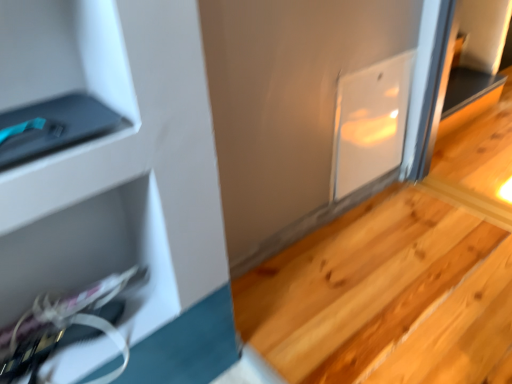
Describe the element at coordinates (372, 290) in the screenshot. I see `natural wood stairs at lower right` at that location.

Where is `natural wood stairs at lower right`? The height and width of the screenshot is (384, 512). natural wood stairs at lower right is located at coordinates (372, 290).

What do you see at coordinates (95, 256) in the screenshot? I see `white glossy scissors at lower left` at bounding box center [95, 256].

In order to face white glossy scissors at lower left, should I rotate leftwards or rightwards?

You should look left and rotate roughly 21.770 degrees.

You are a GUI agent. You are given a task and a screenshot of the screen. Output one action in this format:
    pyautogui.click(x=<x>, y=<y>)
    Task: Click on the white glossy scissors at lower left
    This screenshot has height=384, width=512.
    Given the screenshot: What is the action you would take?
    pyautogui.click(x=95, y=256)

I want to click on natural wood stairs at lower right, so click(x=372, y=290).

Can you confirm if natural wood stairs at lower right is positioned to the right of white glossy scissors at lower left?

Indeed, natural wood stairs at lower right is positioned on the right side of white glossy scissors at lower left.

Is natural wood stairs at lower right positioned before white glossy scissors at lower left?

No.

Does point (481, 305) lie behind point (19, 289)?

That is True.

From the image's perspective, is natural wood stairs at lower right above or below white glossy scissors at lower left?

From the image's perspective, natural wood stairs at lower right appears below white glossy scissors at lower left.

From a real-world perspective, which object stands above the other?

white glossy scissors at lower left, from a real-world perspective.

Looking at their sizes, would you say natural wood stairs at lower right is wider or thinner than white glossy scissors at lower left?

Clearly, natural wood stairs at lower right has more width compared to white glossy scissors at lower left.

Considering the relative sizes of natural wood stairs at lower right and white glossy scissors at lower left in the image provided, is natural wood stairs at lower right shorter than white glossy scissors at lower left?

No, natural wood stairs at lower right is not shorter than white glossy scissors at lower left.

In the scene shown: Does natural wood stairs at lower right have a larger size compared to white glossy scissors at lower left?

Yes, natural wood stairs at lower right is bigger than white glossy scissors at lower left.

Is natural wood stairs at lower right spatially inside white glossy scissors at lower left, or outside of it?

natural wood stairs at lower right is spatially situated outside white glossy scissors at lower left.

Is natural wood stairs at lower right positioned far away from white glossy scissors at lower left?

No, natural wood stairs at lower right is in close proximity to white glossy scissors at lower left.

Is natural wood stairs at lower right aimed at white glossy scissors at lower left?

No, natural wood stairs at lower right is not oriented towards white glossy scissors at lower left.

The image size is (512, 384). Identify the location of stair below the white glossy scissors at lower left (from the image's perspective). (372, 290).

Which is more to the right, white glossy scissors at lower left or natural wood stairs at lower right?

natural wood stairs at lower right.

Is the depth of white glossy scissors at lower left less than that of natural wood stairs at lower right?

Yes, it is.

Between point (152, 311) and point (412, 252), which one is positioned in front?

The point (152, 311) is more forward.

From the image's perspective, which one is positioned lower, white glossy scissors at lower left or natural wood stairs at lower right?

natural wood stairs at lower right.

From a real-world perspective, relative to natural wood stairs at lower right, is white glossy scissors at lower left vertically above or below?

From a real-world perspective, white glossy scissors at lower left is physically above natural wood stairs at lower right.

Considering the relative sizes of white glossy scissors at lower left and natural wood stairs at lower right in the image provided, is white glossy scissors at lower left thinner than natural wood stairs at lower right?

Yes.

From their relative heights in the image, would you say white glossy scissors at lower left is taller or shorter than natural wood stairs at lower right?

white glossy scissors at lower left is shorter than natural wood stairs at lower right.

Considering the sizes of white glossy scissors at lower left and natural wood stairs at lower right in the image, is white glossy scissors at lower left bigger or smaller than natural wood stairs at lower right?

In the image, white glossy scissors at lower left appears to be smaller than natural wood stairs at lower right.

Is white glossy scissors at lower left surrounding natural wood stairs at lower right?

No, natural wood stairs at lower right is located outside of white glossy scissors at lower left.

Is white glossy scissors at lower left not close to natural wood stairs at lower right?

They are positioned close to each other.

Is white glossy scissors at lower left oriented towards natural wood stairs at lower right?

No.

Locate an element on the screen. This screenshot has height=384, width=512. stair below the white glossy scissors at lower left (from the image's perspective) is located at coordinates (372, 290).

Where is `stair on the right of white glossy scissors at lower left`? The image size is (512, 384). stair on the right of white glossy scissors at lower left is located at coordinates (372, 290).

Locate an element on the screen. The height and width of the screenshot is (384, 512). stair lying below the white glossy scissors at lower left (from the image's perspective) is located at coordinates (372, 290).